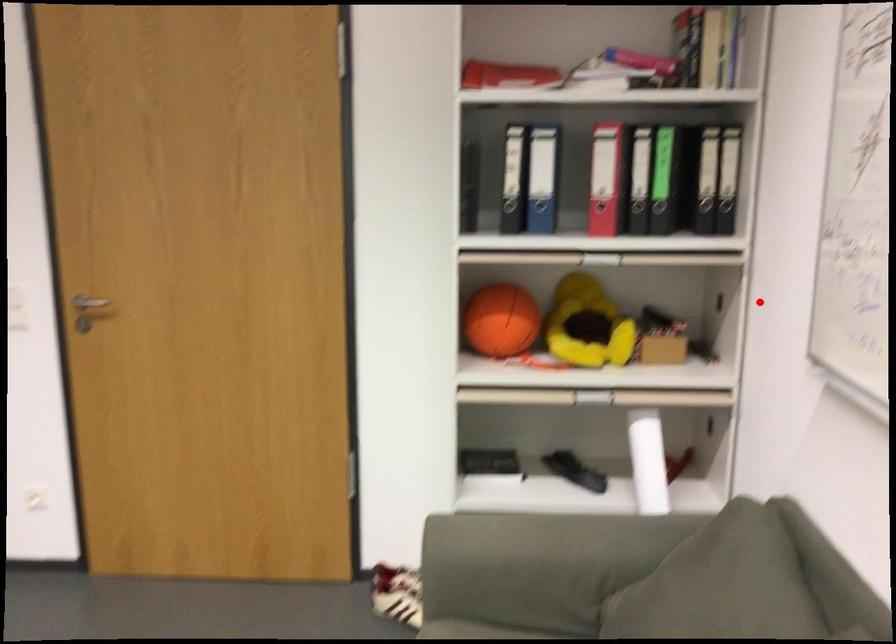
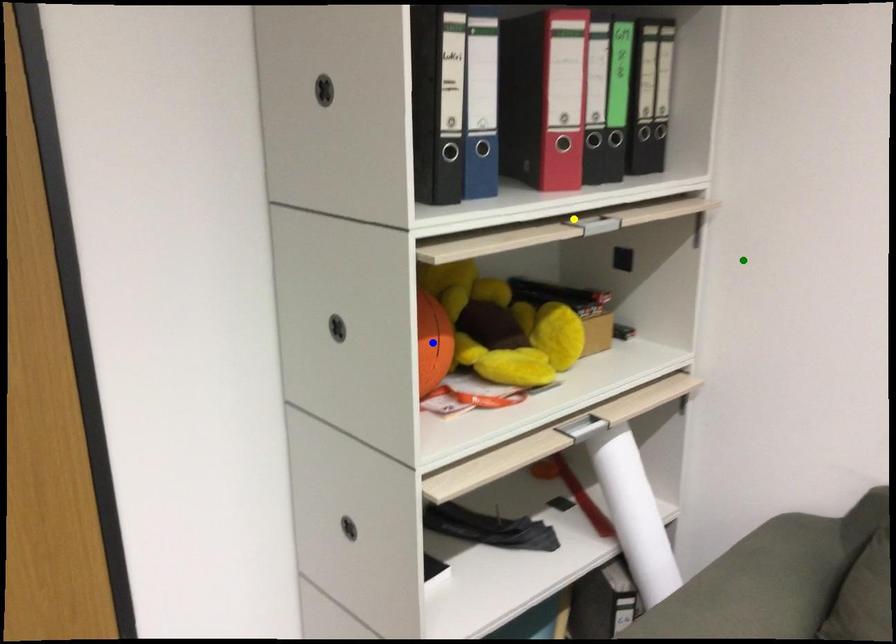
Question: I am providing you with two images of the same scene from different viewpoints. A red point is marked on the first image. You are given multiple points on the second image. Which point in image 2 represents the same 3d spot as the red point in image 1?

Choices:
 (A) green point
 (B) yellow point
 (C) blue point

Answer: (A)